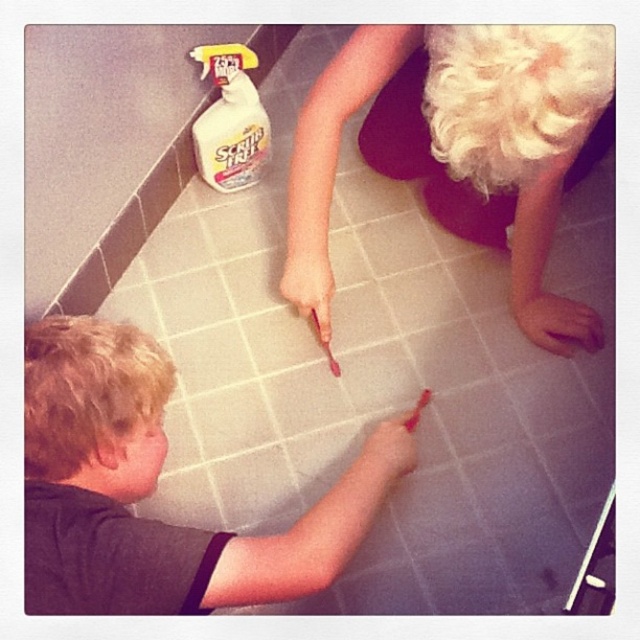
You are a parent observing two children playing on the floor. You notice the smooth skin boy at lower left and the pink matte hand at lower right. Which child do you think has a wider body?

The smooth skin boy at lower left has a wider body than the pink matte hand at lower right because the smooth skin boy at lower left is described as larger in width.

In the scene shown: You are a parent observing two children playing on the tiled floor. You notice the smooth skin boy at lower left and the pink matte hand at lower right. Which child is taller?

The smooth skin boy at lower left is taller than the pink matte hand at lower right.